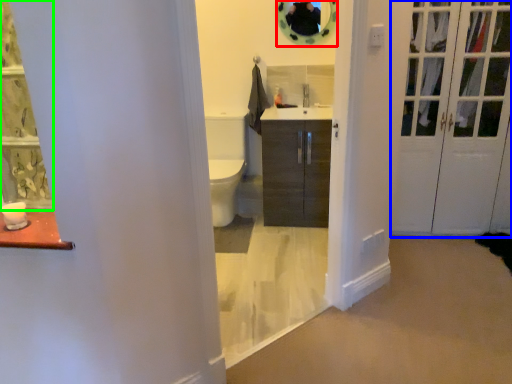
Question: Estimate the real-world distances between objects in this image. Which object is closer to mirror (highlighted by a red box), door (highlighted by a blue box) or curtain (highlighted by a green box)?

Choices:
 (A) door
 (B) curtain

Answer: (A)